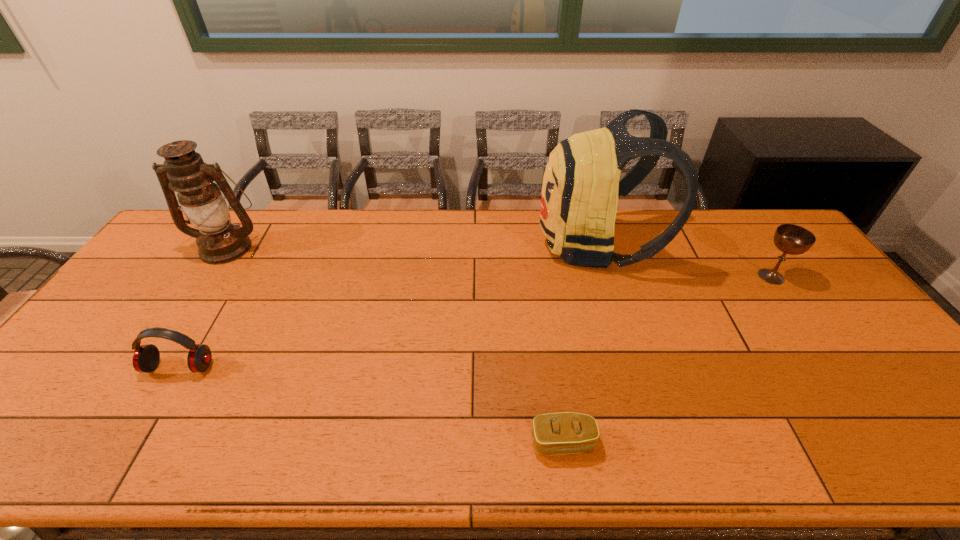
Identify the location of vacant space that is in between the lantern and the third tallest object. The height and width of the screenshot is (540, 960). (499, 262).

The height and width of the screenshot is (540, 960). What are the coordinates of `free space between the chalice and the lantern` in the screenshot? It's located at (499, 262).

I want to click on unoccupied area between the second nearest object and the backpack, so click(x=388, y=306).

Locate an element on the screen. The height and width of the screenshot is (540, 960). free space between the nearest object and the second shortest object is located at coordinates [372, 405].

In order to click on free point between the shortest object and the chalice in this screenshot , I will do `click(667, 360)`.

Identify which object is located as the third nearest to the earphone. Please provide its 2D coordinates. Your answer should be formatted as a tuple, i.e. [(x, y)], where the tuple contains the x and y coordinates of a point satisfying the conditions above.

[(579, 199)]

Locate which object ranks second in proximity to the lantern. Please provide its 2D coordinates. Your answer should be formatted as a tuple, i.e. [(x, y)], where the tuple contains the x and y coordinates of a point satisfying the conditions above.

[(579, 199)]

You are a GUI agent. You are given a task and a screenshot of the screen. Output one action in this format:
    pyautogui.click(x=<x>, y=<y>)
    Task: Click on the free spot that satisfies the following two spatial constraints: 1. on the front-facing side of the rightmost object; 2. on the left side of the backpack
    The width and height of the screenshot is (960, 540).
    Given the screenshot: What is the action you would take?
    pyautogui.click(x=606, y=276)

Identify the location of vacant region that satisfies the following two spatial constraints: 1. on the front side of the rightmost object; 2. on the left side of the lantern. Image resolution: width=960 pixels, height=540 pixels. (207, 276).

Identify the location of free region that satisfies the following two spatial constraints: 1. on the front-facing side of the backpack; 2. on the zipper side of the clutch bag. The image size is (960, 540). (656, 442).